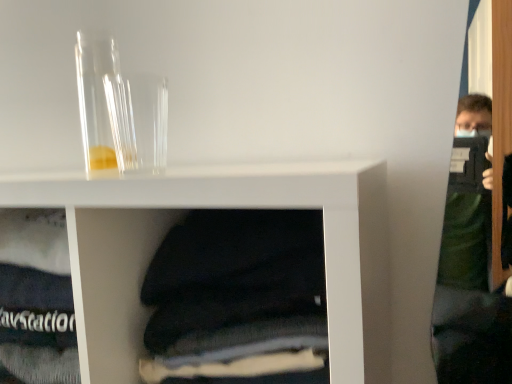
Question: From a real-world perspective, is transparent glass tube at upper left, positioned as the 2th glass vase in right-to-left order, positioned over transparent glass vase at upper left, positioned as the second glass vase in left-to-right order, based on gravity?

Choices:
 (A) yes
 (B) no

Answer: (A)

Question: Is transparent glass tube at upper left, positioned as the 2th glass vase in right-to-left order, looking in the opposite direction of transparent glass vase at upper left, positioned as the second glass vase in left-to-right order?

Choices:
 (A) no
 (B) yes

Answer: (A)

Question: Is transparent glass tube at upper left, positioned as the 2th glass vase in right-to-left order, wider than transparent glass vase at upper left, which is the 1th glass vase from right to left?

Choices:
 (A) no
 (B) yes

Answer: (A)

Question: Is transparent glass tube at upper left, which is counted as the first glass vase, starting from the left, positioned far away from transparent glass vase at upper left, which is the 1th glass vase from right to left?

Choices:
 (A) yes
 (B) no

Answer: (B)

Question: Considering the relative positions of transparent glass tube at upper left, which is counted as the first glass vase, starting from the left, and transparent glass vase at upper left, positioned as the second glass vase in left-to-right order, in the image provided, is transparent glass tube at upper left, which is counted as the first glass vase, starting from the left, to the left of transparent glass vase at upper left, positioned as the second glass vase in left-to-right order, from the viewer's perspective?

Choices:
 (A) yes
 (B) no

Answer: (A)

Question: Does transparent glass tube at upper left, positioned as the 2th glass vase in right-to-left order, contain transparent glass vase at upper left, positioned as the second glass vase in left-to-right order?

Choices:
 (A) no
 (B) yes

Answer: (A)

Question: Considering the relative sizes of transparent glass vase at upper left, which is the 1th glass vase from right to left, and transparent glass tube at upper left, positioned as the 2th glass vase in right-to-left order, in the image provided, is transparent glass vase at upper left, which is the 1th glass vase from right to left, taller than transparent glass tube at upper left, positioned as the 2th glass vase in right-to-left order,?

Choices:
 (A) yes
 (B) no

Answer: (B)

Question: Is transparent glass vase at upper left, which is the 1th glass vase from right to left, shorter than transparent glass tube at upper left, which is counted as the first glass vase, starting from the left?

Choices:
 (A) no
 (B) yes

Answer: (B)

Question: Would you say transparent glass vase at upper left, positioned as the second glass vase in left-to-right order, is a long distance from transparent glass tube at upper left, which is counted as the first glass vase, starting from the left?

Choices:
 (A) yes
 (B) no

Answer: (B)

Question: Can you confirm if transparent glass vase at upper left, which is the 1th glass vase from right to left, is wider than transparent glass tube at upper left, positioned as the 2th glass vase in right-to-left order?

Choices:
 (A) no
 (B) yes

Answer: (B)

Question: From the image's perspective, is transparent glass vase at upper left, positioned as the second glass vase in left-to-right order, beneath transparent glass tube at upper left, which is counted as the first glass vase, starting from the left?

Choices:
 (A) no
 (B) yes

Answer: (B)

Question: Is transparent glass vase at upper left, which is the 1th glass vase from right to left, smaller than transparent glass tube at upper left, positioned as the 2th glass vase in right-to-left order?

Choices:
 (A) no
 (B) yes

Answer: (B)

Question: Is transparent glass vase at upper left, positioned as the second glass vase in left-to-right order, situated inside transparent glass tube at upper left, which is counted as the first glass vase, starting from the left, or outside?

Choices:
 (A) inside
 (B) outside

Answer: (B)